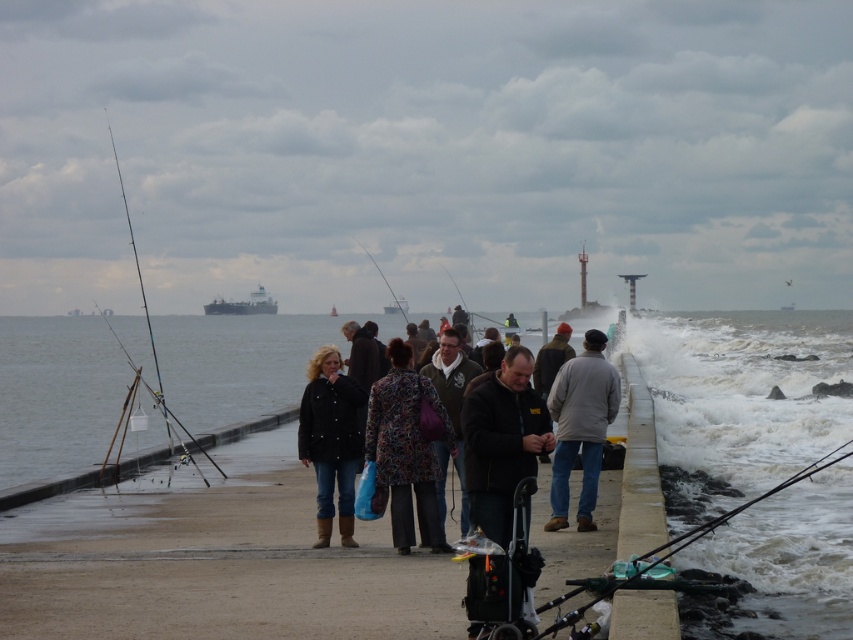
Does point (428, 381) come behind point (251, 305)?

No, (428, 381) is closer to viewer.

Does patterned fabric coat at center lie behind white matte ship at center?

No, it is in front of white matte ship at center.

Between point (457, 417) and point (219, 308), which one is positioned in front?

Positioned in front is point (457, 417).

Where is `patterned fabric coat at center`? The width and height of the screenshot is (853, 640). patterned fabric coat at center is located at coordinates (453, 438).

Where is `patterned fabric coat at center`? The width and height of the screenshot is (853, 640). patterned fabric coat at center is located at coordinates (453, 438).

Where is `patterned fabric coat at center`? This screenshot has width=853, height=640. patterned fabric coat at center is located at coordinates [x=453, y=438].

The width and height of the screenshot is (853, 640). In order to click on patterned fabric coat at center in this screenshot , I will do `click(453, 438)`.

Does point (334, 420) lie in front of point (397, 301)?

Yes.

Who is shorter, matte black jacket at center or metallic gray ship at center?

Standing shorter between the two is matte black jacket at center.

What are the coordinates of `matte black jacket at center` in the screenshot? It's located at (331, 440).